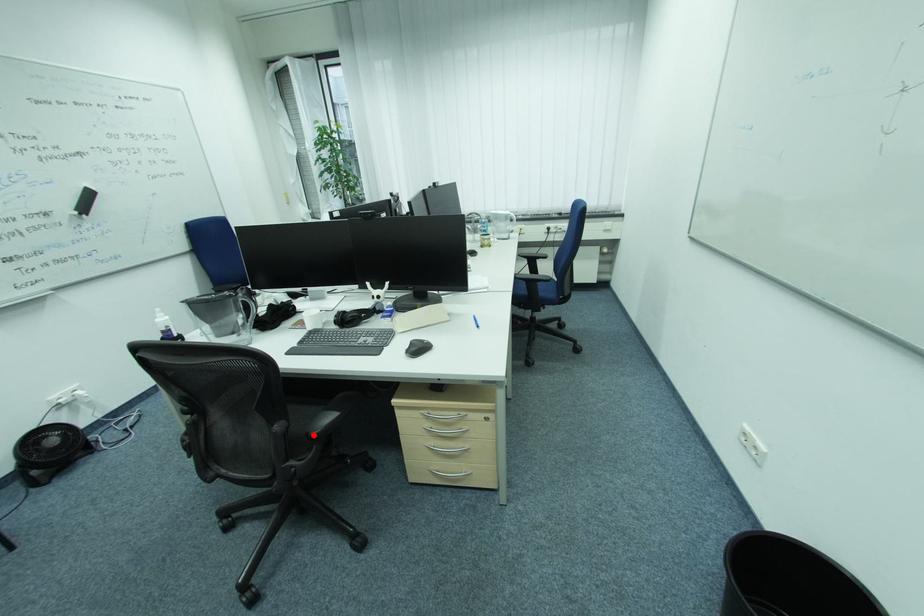
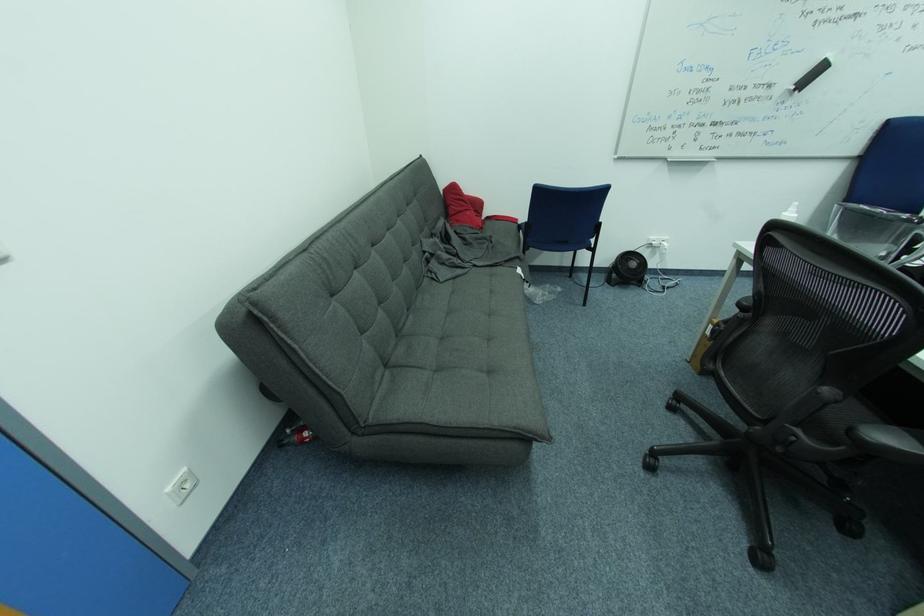
In the second image, find the point that corresponds to the highlighted location in the first image.

(858, 430)